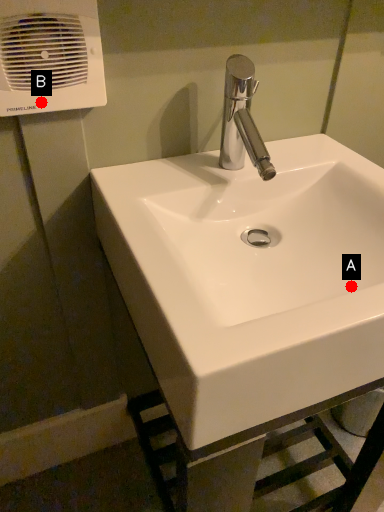
Question: Two points are circled on the image, labeled by A and B beside each circle. Which point is closer to the camera taking this photo?

Choices:
 (A) A is closer
 (B) B is closer

Answer: (A)